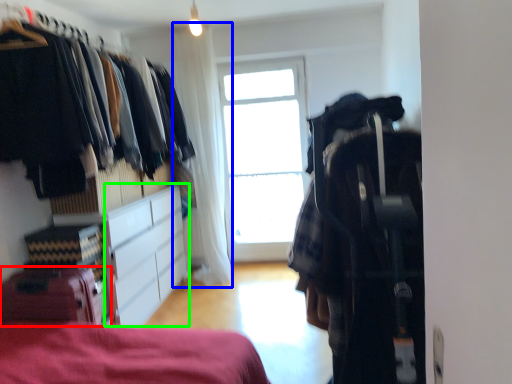
Question: Which object is the closest to the luggage (highlighted by a red box)? Choose among these: curtain (highlighted by a blue box) or cabinetry (highlighted by a green box).

Choices:
 (A) curtain
 (B) cabinetry

Answer: (B)